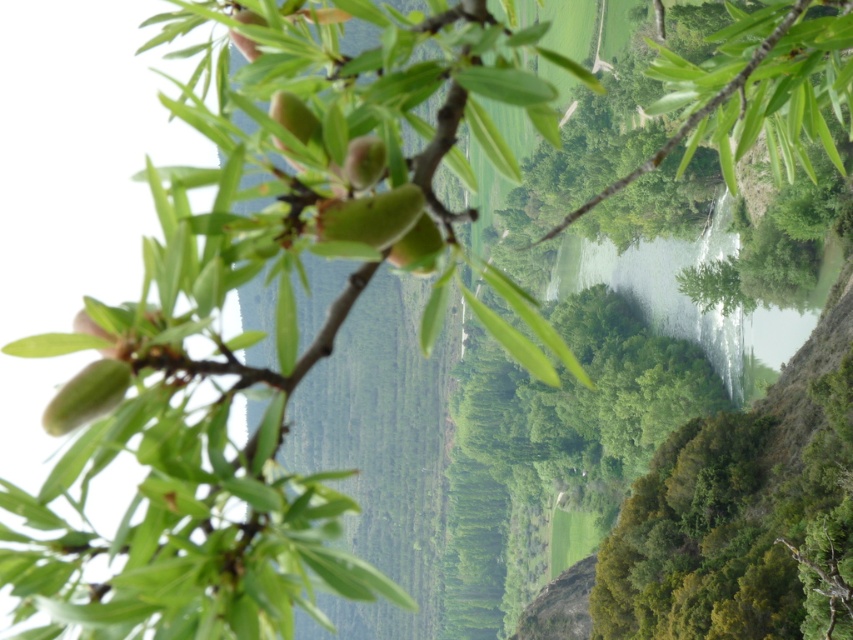
Question: From the image, what is the correct spatial relationship of green matte leaves at center in relation to green leafy branch at center?

Choices:
 (A) right
 (B) left

Answer: (B)

Question: Which point is closer to the camera taking this photo?

Choices:
 (A) (722, 138)
 (B) (241, 387)

Answer: (B)

Question: Is green matte leaves at center to the left of green leafy branch at center from the viewer's perspective?

Choices:
 (A) yes
 (B) no

Answer: (A)

Question: Which point appears farthest from the camera in this image?

Choices:
 (A) (682, 134)
 (B) (299, 131)

Answer: (A)

Question: Does green matte leaves at center appear over green leafy branch at center?

Choices:
 (A) no
 (B) yes

Answer: (A)